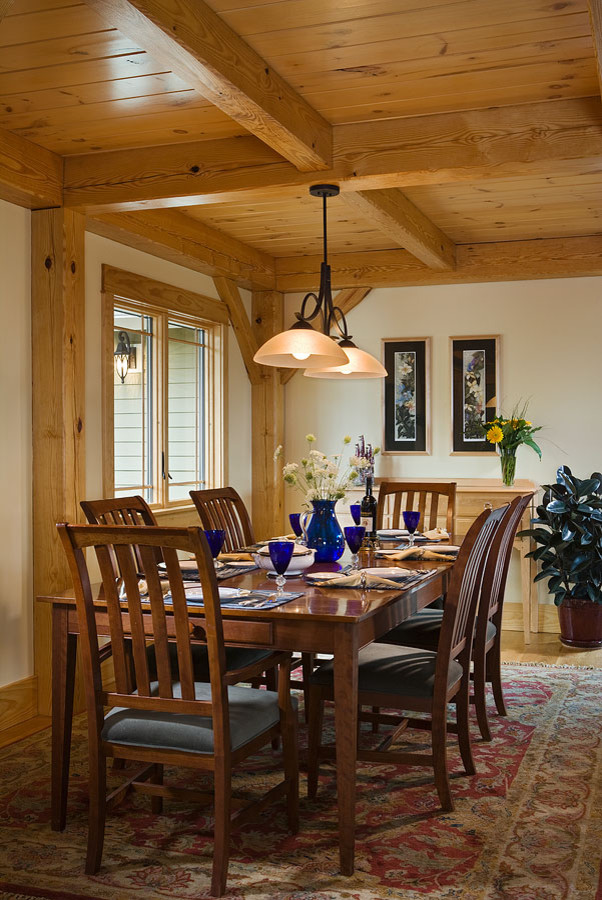
Where is `joist`? Image resolution: width=602 pixels, height=900 pixels. joist is located at coordinates (397, 226), (388, 178), (249, 194), (306, 166).